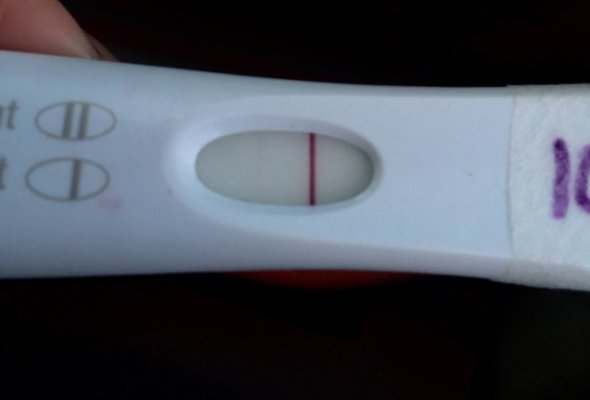
Where is `purple marker`? The width and height of the screenshot is (590, 400). purple marker is located at coordinates (563, 194), (581, 185).